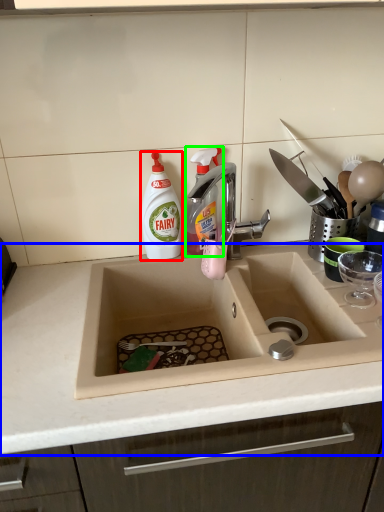
Question: Estimate the real-world distances between objects in this image. Which object is farther from cleaning product (highlighted by a red box), countertop (highlighted by a blue box) or cleaning product (highlighted by a green box)?

Choices:
 (A) countertop
 (B) cleaning product

Answer: (A)